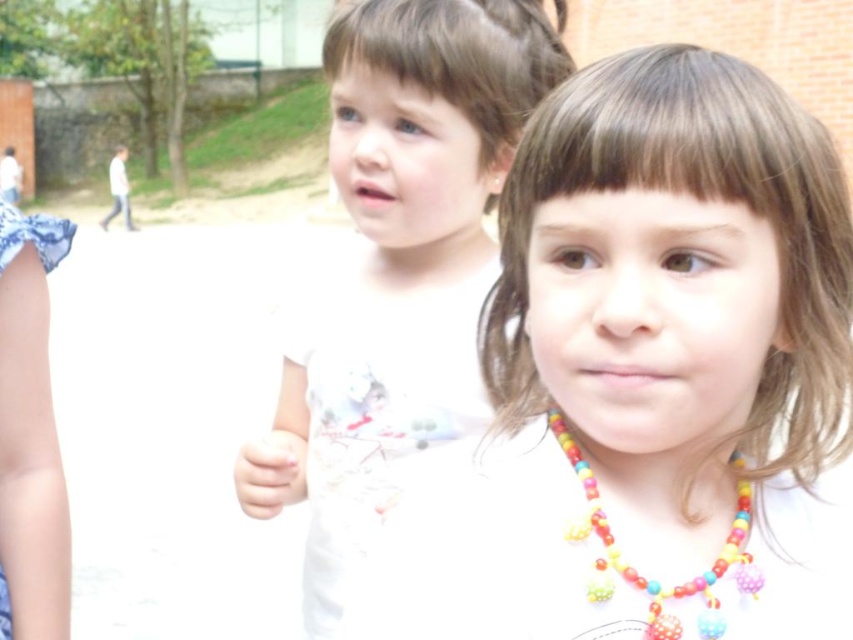
Does point (450, 19) come farther from viewer compared to point (236, 476)?

No.

Does white matte shirt at center appear under white matte hand at center?

No, white matte shirt at center is not below white matte hand at center.

The width and height of the screenshot is (853, 640). Find the location of `white matte shirt at center`. white matte shirt at center is located at coordinates (405, 250).

Which is more to the left, white matte necklace at center or white matte shirt at center?

white matte shirt at center

Is point (770, 353) positioned in front of point (453, 56)?

Yes, point (770, 353) is in front of point (453, 56).

You are a GUI agent. You are given a task and a screenshot of the screen. Output one action in this format:
    pyautogui.click(x=<x>, y=<y>)
    Task: Click on the white matte necklace at center
    This screenshot has width=853, height=640.
    Given the screenshot: What is the action you would take?
    pyautogui.click(x=643, y=376)

Where is `white matte necklace at center`? The width and height of the screenshot is (853, 640). white matte necklace at center is located at coordinates (643, 376).

Does point (448, 598) come in front of point (647, 582)?

Yes, it is.

This screenshot has height=640, width=853. What do you see at coordinates (643, 376) in the screenshot?
I see `white matte necklace at center` at bounding box center [643, 376].

I want to click on white matte necklace at center, so click(x=643, y=376).